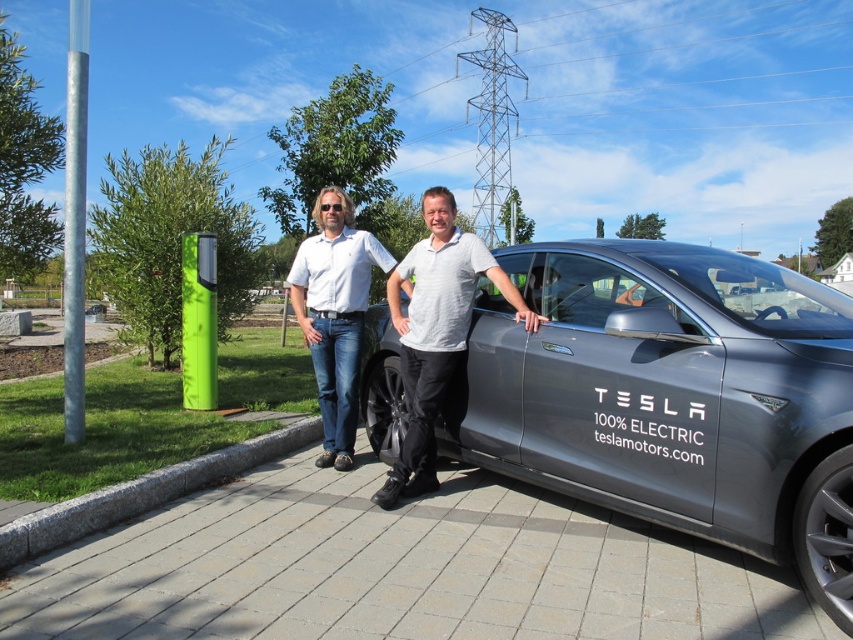
Can you confirm if sleek metallic tesla at center is positioned below gray matte shirt at center?

Indeed, sleek metallic tesla at center is positioned under gray matte shirt at center.

Is point (837, 404) closer to camera compared to point (407, 458)?

Yes, point (837, 404) is closer to viewer.

I want to click on sleek metallic tesla at center, so click(671, 396).

Identify the location of sleek metallic tesla at center. The width and height of the screenshot is (853, 640). (671, 396).

Can you confirm if sleek metallic tesla at center is positioned above white cotton shirt at center?

Incorrect, sleek metallic tesla at center is not positioned above white cotton shirt at center.

Is point (785, 342) less distant than point (338, 412)?

That is True.

Find the location of a particular element. sleek metallic tesla at center is located at coordinates (671, 396).

The height and width of the screenshot is (640, 853). What are the coordinates of `gray matte shirt at center` in the screenshot? It's located at (436, 332).

Who is shorter, gray matte shirt at center or white cotton shirt at center?

gray matte shirt at center is shorter.

Is point (430, 248) closer to camera compared to point (364, 288)?

Yes, it is in front of point (364, 288).

At what (x,y) coordinates should I click in order to perform the action: click on gray matte shirt at center. Please return your answer as a coordinate pair (x, y). This screenshot has width=853, height=640. Looking at the image, I should click on (436, 332).